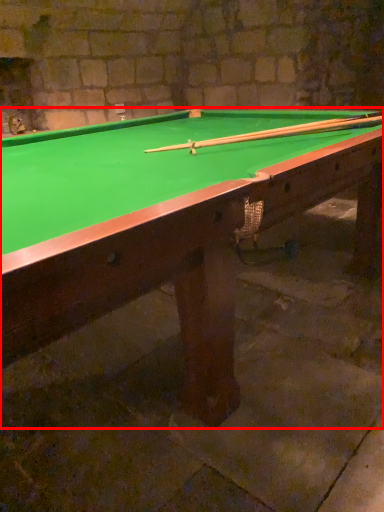
Question: From the image's perspective, what is the correct spatial positioning of billiard table (annotated by the red box) in reference to cue?

Choices:
 (A) above
 (B) below

Answer: (B)